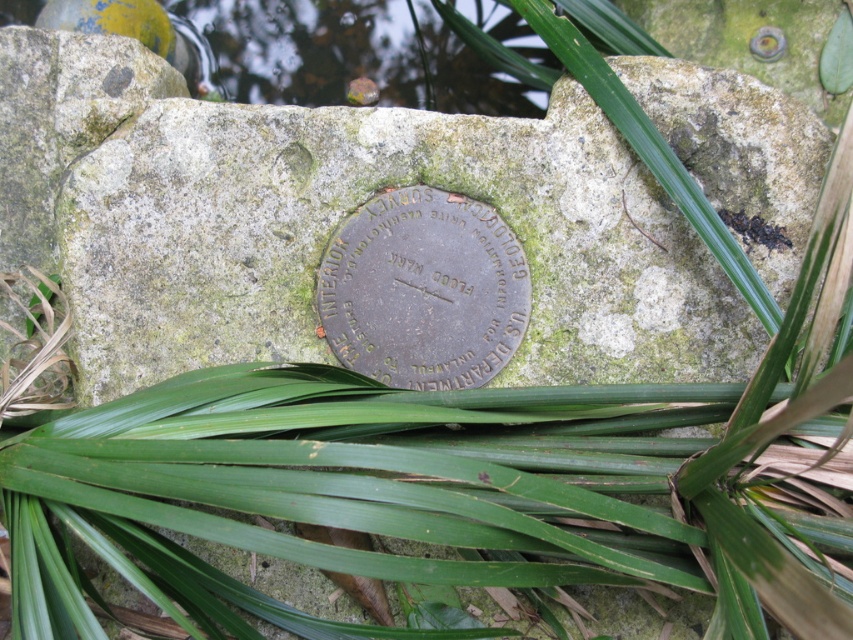
Which of these two, green mossy stone at center or bronze metallic plaque at center, stands taller?

green mossy stone at center

Image resolution: width=853 pixels, height=640 pixels. Identify the location of green mossy stone at center. (355, 209).